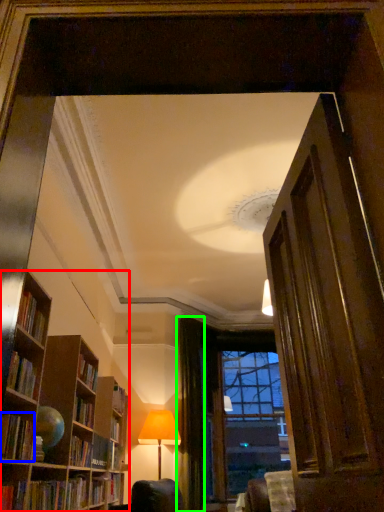
Question: Considering the real-world distances, which object is closest to bookcase (highlighted by a red box)? book (highlighted by a blue box) or curtain (highlighted by a green box).

Choices:
 (A) book
 (B) curtain

Answer: (A)